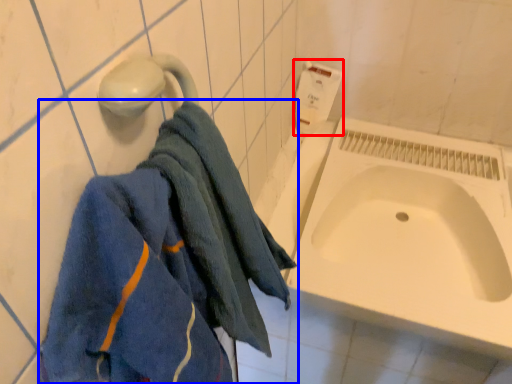
Question: Which of the following is the farthest to the observer, toilet paper (highlighted by a red box) or towel (highlighted by a blue box)?

Choices:
 (A) toilet paper
 (B) towel

Answer: (A)